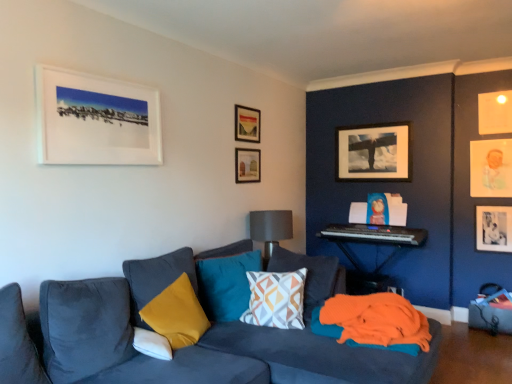
Question: From a real-world perspective, does gray fabric lampshade at center sit lower than orange fabric at lower right?

Choices:
 (A) yes
 (B) no

Answer: (B)

Question: Is gray fabric lampshade at center oriented towards orange fabric at lower right?

Choices:
 (A) no
 (B) yes

Answer: (A)

Question: Is gray fabric lampshade at center not inside orange fabric at lower right?

Choices:
 (A) no
 (B) yes

Answer: (B)

Question: Is gray fabric lampshade at center wider than orange fabric at lower right?

Choices:
 (A) yes
 (B) no

Answer: (B)

Question: Does gray fabric lampshade at center appear on the left side of orange fabric at lower right?

Choices:
 (A) yes
 (B) no

Answer: (A)

Question: From the image's perspective, is gray fabric lampshade at center above or below velvet yellow pillow at lower left, which is the 3th pillow in back-to-front order?

Choices:
 (A) below
 (B) above

Answer: (B)

Question: Considering the positions of gray fabric lampshade at center and velvet yellow pillow at lower left, the second pillow from the front, in the image, is gray fabric lampshade at center wider or thinner than velvet yellow pillow at lower left, the second pillow from the front,?

Choices:
 (A) wide
 (B) thin

Answer: (A)

Question: Is gray fabric lampshade at center inside the boundaries of velvet yellow pillow at lower left, which is the 3th pillow in back-to-front order, or outside?

Choices:
 (A) inside
 (B) outside

Answer: (B)

Question: Considering their positions, is gray fabric lampshade at center located in front of or behind velvet yellow pillow at lower left, which is the 3th pillow in back-to-front order?

Choices:
 (A) front
 (B) behind

Answer: (B)

Question: Considering the positions of yellow fabric pillow at center, acting as the 4th pillow starting from the front, and matte white picture frame at upper right, arranged as the 6th picture frame when viewed from the left, in the image, is yellow fabric pillow at center, acting as the 4th pillow starting from the front, bigger or smaller than matte white picture frame at upper right, arranged as the 6th picture frame when viewed from the left,?

Choices:
 (A) small
 (B) big

Answer: (B)

Question: From a real-world perspective, is yellow fabric pillow at center, acting as the 4th pillow starting from the front, positioned above or below matte white picture frame at upper right, the second picture frame when ordered from right to left?

Choices:
 (A) above
 (B) below

Answer: (B)

Question: From their relative heights in the image, would you say yellow fabric pillow at center, the 1th pillow when ordered from back to front, is taller or shorter than matte white picture frame at upper right, marked as the 4th picture frame in a back-to-front arrangement?

Choices:
 (A) tall
 (B) short

Answer: (A)

Question: Is yellow fabric pillow at center, acting as the 4th pillow starting from the front, situated inside matte white picture frame at upper right, the second picture frame when ordered from right to left, or outside?

Choices:
 (A) inside
 (B) outside

Answer: (B)

Question: Is velvet yellow pillow at lower left, which is the 3th pillow in back-to-front order, wider or thinner than yellow fabric pillow at center, acting as the 4th pillow starting from the front?

Choices:
 (A) wide
 (B) thin

Answer: (A)

Question: Based on their sizes in the image, would you say velvet yellow pillow at lower left, which is the 3th pillow in back-to-front order, is bigger or smaller than yellow fabric pillow at center, the 1th pillow when ordered from back to front?

Choices:
 (A) big
 (B) small

Answer: (A)